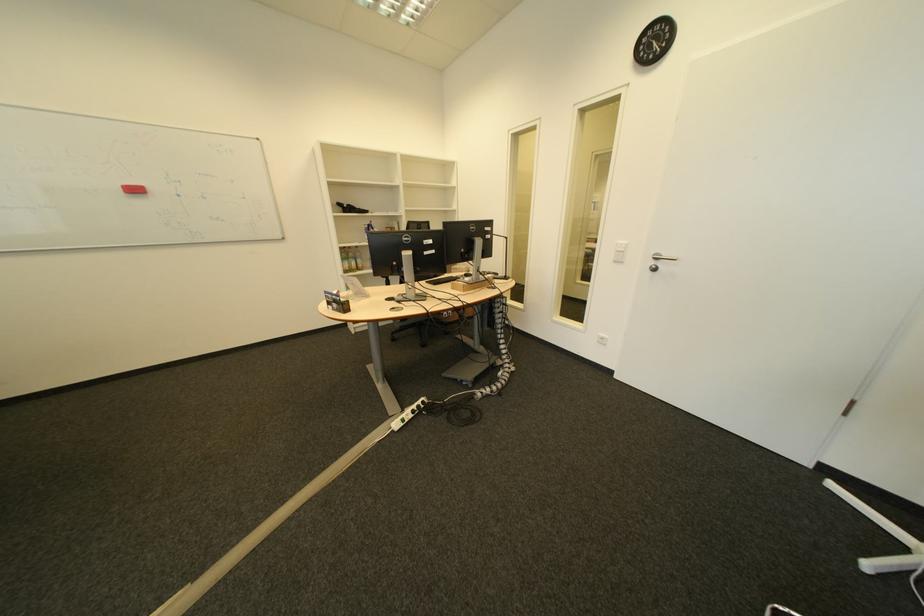
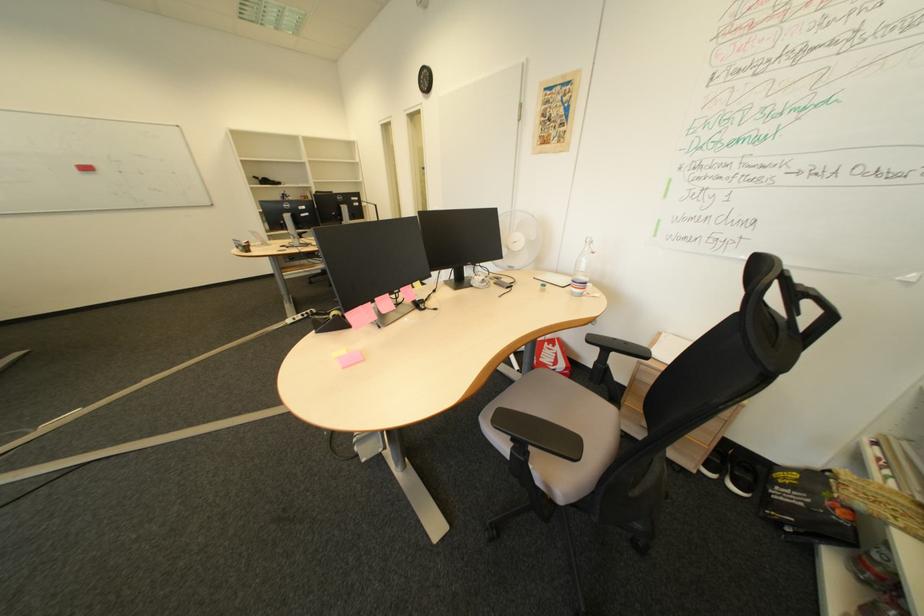
The point at (192, 197) is marked in the first image. Where is the corresponding point in the second image?

(135, 174)